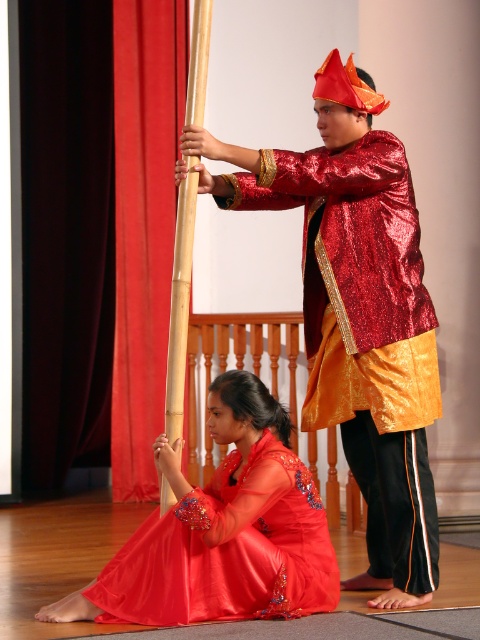
Does shiny red robe at center have a greater height compared to satin red dress at lower center?

Yes, shiny red robe at center is taller than satin red dress at lower center.

From the picture: Does shiny red robe at center appear over satin red dress at lower center?

Yes.

The width and height of the screenshot is (480, 640). Describe the element at coordinates (365, 333) in the screenshot. I see `shiny red robe at center` at that location.

What are the coordinates of `shiny red robe at center` in the screenshot? It's located at (365, 333).